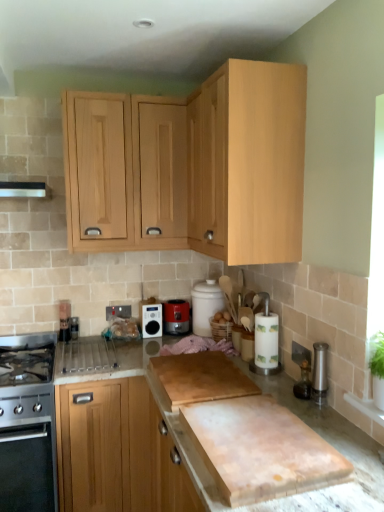
Describe the element at coordinates (249, 162) in the screenshot. I see `light wood cabinet at upper center, the 3th cabinetry from the top` at that location.

Where is `metallic silver toaster at lower left`? The image size is (384, 512). metallic silver toaster at lower left is located at coordinates (65, 320).

Measure the distance between point (196, 168) and camera.

A distance of 6.68 feet exists between point (196, 168) and camera.

This screenshot has width=384, height=512. I want to click on light wood cabinet at upper center, which is counted as the first cabinetry, starting from the top, so click(x=127, y=172).

What do you see at coordinates (176, 316) in the screenshot? I see `matte red toaster at center, which ranks as the third kitchen appliance in left-to-right order` at bounding box center [176, 316].

What are the coordinates of `matte red toaster at center, which ranks as the third kitchen appliance in left-to-right order` in the screenshot? It's located at (176, 316).

Where is `light wood cabinet at upper center, the 3th cabinetry from the top`? light wood cabinet at upper center, the 3th cabinetry from the top is located at coordinates (249, 162).

Is point (155, 313) positioned after point (100, 245)?

Yes, it is behind point (100, 245).

From a real-world perspective, is matte black radio at center, the 2th kitchen appliance when ordered from bottom to top, physically located above or below light wood cabinet at upper center, which is counted as the first cabinetry, starting from the top?

From a real-world perspective, matte black radio at center, the 2th kitchen appliance when ordered from bottom to top, is physically below light wood cabinet at upper center, which is counted as the first cabinetry, starting from the top.

Considering the positions of objects matte black radio at center, which is counted as the 2th kitchen appliance, starting from the left, and light wood cabinet at upper center, the fourth cabinetry in the bottom-to-top sequence, in the image provided, who is behind, matte black radio at center, which is counted as the 2th kitchen appliance, starting from the left, or light wood cabinet at upper center, the fourth cabinetry in the bottom-to-top sequence,?

matte black radio at center, which is counted as the 2th kitchen appliance, starting from the left, is more distant.

Is matte black radio at center, the 2th kitchen appliance when ordered from bottom to top, directly adjacent to light wood cabinet at upper center, which is counted as the first cabinetry, starting from the top?

matte black radio at center, the 2th kitchen appliance when ordered from bottom to top, and light wood cabinet at upper center, which is counted as the first cabinetry, starting from the top, are not in contact.

In the scene shown: Which point is more forward, (148, 313) or (228, 67)?

The point (228, 67) is more forward.

In the scene shown: From a real-world perspective, who is located higher, matte black radio at center, which is counted as the 2th kitchen appliance, starting from the left, or light wood cabinet at upper center, the 3th cabinetry from the top?

light wood cabinet at upper center, the 3th cabinetry from the top, is physically above.

Does matte black radio at center, which is the second kitchen appliance in top-to-bottom order, have a lesser height compared to light wood cabinet at upper center, the 3th cabinetry from the top?

Correct, matte black radio at center, which is the second kitchen appliance in top-to-bottom order, is not as tall as light wood cabinet at upper center, the 3th cabinetry from the top.

Is matte black radio at center, which is counted as the 2th kitchen appliance, starting from the left, next to light wood cabinet at upper center, the 3th cabinetry from the top, and touching it?

No, matte black radio at center, which is counted as the 2th kitchen appliance, starting from the left, is not touching light wood cabinet at upper center, the 3th cabinetry from the top.

Considering the relative sizes of matte red toaster at center, which is the 1th kitchen appliance in top-to-bottom order, and light wood cabinet at upper center, the 3th cabinetry from the top, in the image provided, is matte red toaster at center, which is the 1th kitchen appliance in top-to-bottom order, shorter than light wood cabinet at upper center, the 3th cabinetry from the top,?

Yes, matte red toaster at center, which is the 1th kitchen appliance in top-to-bottom order, is shorter than light wood cabinet at upper center, the 3th cabinetry from the top.

At what (x,y) coordinates should I click in order to perform the action: click on the 1st kitchen appliance below when counting from the light wood cabinet at upper center, the 3th cabinetry from the top (from the image's perspective). Please return your answer as a coordinate pair (x, y). Looking at the image, I should click on (176, 316).

Does matte red toaster at center, marked as the 3th kitchen appliance in a bottom-to-top arrangement, touch light wood cabinet at upper center, the 3th cabinetry from the top?

No, matte red toaster at center, marked as the 3th kitchen appliance in a bottom-to-top arrangement, is not beside light wood cabinet at upper center, the 3th cabinetry from the top.

Is light wood cabinet at upper center, the 2th cabinetry positioned from the bottom, at the back of matte red toaster at center, marked as the 3th kitchen appliance in a bottom-to-top arrangement?

No, matte red toaster at center, marked as the 3th kitchen appliance in a bottom-to-top arrangement, is not facing away from light wood cabinet at upper center, the 2th cabinetry positioned from the bottom.

From the image's perspective, is stainless steel oven at left, which is counted as the 3th kitchen appliance, starting from the top, on top of light wood cabinet at lower left, the 4th cabinetry viewed from the top?

No, from the image's perspective, stainless steel oven at left, which is counted as the 3th kitchen appliance, starting from the top, is not over light wood cabinet at lower left, the 4th cabinetry viewed from the top.

Does stainless steel oven at left, marked as the third kitchen appliance in a right-to-left arrangement, have a greater height compared to light wood cabinet at lower left, positioned as the 1th cabinetry in bottom-to-top order?

In fact, stainless steel oven at left, marked as the third kitchen appliance in a right-to-left arrangement, may be shorter than light wood cabinet at lower left, positioned as the 1th cabinetry in bottom-to-top order.

What's the angular difference between stainless steel oven at left, which is counted as the 3th kitchen appliance, starting from the top, and light wood cabinet at lower left, the 4th cabinetry viewed from the top,'s facing directions?

The facing directions of stainless steel oven at left, which is counted as the 3th kitchen appliance, starting from the top, and light wood cabinet at lower left, the 4th cabinetry viewed from the top, are 1.11 degrees apart.

Consider the image. Is light wood cabinet at lower left, positioned as the 1th cabinetry in bottom-to-top order, at the back of stainless steel oven at left, which is counted as the 3th kitchen appliance, starting from the top?

stainless steel oven at left, which is counted as the 3th kitchen appliance, starting from the top, is not turned away from light wood cabinet at lower left, positioned as the 1th cabinetry in bottom-to-top order.

Looking at this image, does natural wood cabinet at upper center, which is the 2th cabinetry from top to bottom, turn towards matte black radio at center, which is counted as the 2th kitchen appliance, starting from the left?

No, natural wood cabinet at upper center, which is the 2th cabinetry from top to bottom, does not turn towards matte black radio at center, which is counted as the 2th kitchen appliance, starting from the left.

Which cabinetry is the 1st one when counting from the right side of the matte black radio at center, the 2th kitchen appliance when ordered from bottom to top? Please provide its 2D coordinates.

[(191, 167)]

Considering the relative sizes of natural wood cabinet at upper center, which is the 2th cabinetry from top to bottom, and matte black radio at center, which is the second kitchen appliance in top-to-bottom order, in the image provided, is natural wood cabinet at upper center, which is the 2th cabinetry from top to bottom, thinner than matte black radio at center, which is the second kitchen appliance in top-to-bottom order,?

Incorrect, the width of natural wood cabinet at upper center, which is the 2th cabinetry from top to bottom, is not less than that of matte black radio at center, which is the second kitchen appliance in top-to-bottom order.

From the image's perspective, is natural wood cabinet at upper center, the 3th cabinetry ordered from the bottom, on matte black radio at center, which is counted as the 2th kitchen appliance, starting from the left?

Yes, from the image's perspective, natural wood cabinet at upper center, the 3th cabinetry ordered from the bottom, is on top of matte black radio at center, which is counted as the 2th kitchen appliance, starting from the left.

Consider the image. Between metallic silver toaster at lower left and light wood cabinet at lower left, positioned as the 1th cabinetry in bottom-to-top order, which one is positioned behind?

metallic silver toaster at lower left is further away from the camera.

Is metallic silver toaster at lower left outside of light wood cabinet at lower left, positioned as the 1th cabinetry in bottom-to-top order?

Absolutely, metallic silver toaster at lower left is external to light wood cabinet at lower left, positioned as the 1th cabinetry in bottom-to-top order.

Is metallic silver toaster at lower left looking in the opposite direction of light wood cabinet at lower left, the 4th cabinetry viewed from the top?

That's not correct — metallic silver toaster at lower left is not looking away from light wood cabinet at lower left, the 4th cabinetry viewed from the top.

Is point (70, 320) farther from camera compared to point (74, 410)?

Yes, it is.

From the image's perspective, which object appears higher, light wood cabinet at upper center, the fourth cabinetry in the bottom-to-top sequence, or natural wood cabinet at upper center, which is the 2th cabinetry from top to bottom?

light wood cabinet at upper center, the fourth cabinetry in the bottom-to-top sequence, appears higher in the image.

How many degrees apart are the facing directions of light wood cabinet at upper center, the fourth cabinetry in the bottom-to-top sequence, and natural wood cabinet at upper center, which is the 2th cabinetry from top to bottom?

0.000802 degrees separate the facing orientations of light wood cabinet at upper center, the fourth cabinetry in the bottom-to-top sequence, and natural wood cabinet at upper center, which is the 2th cabinetry from top to bottom.

Considering the relative sizes of light wood cabinet at upper center, the fourth cabinetry in the bottom-to-top sequence, and natural wood cabinet at upper center, the 3th cabinetry ordered from the bottom, in the image provided, is light wood cabinet at upper center, the fourth cabinetry in the bottom-to-top sequence, wider than natural wood cabinet at upper center, the 3th cabinetry ordered from the bottom,?

No.

The image size is (384, 512). Identify the location of the 1st cabinetry to the left of the matte black radio at center, which is the second kitchen appliance in top-to-bottom order, counting from the anchor's position. (127, 172).

The height and width of the screenshot is (512, 384). What are the coordinates of `kitchen appliance that is the 2nd object located below the light wood cabinet at upper center, the 3th cabinetry from the top (from the image's perspective)` in the screenshot? It's located at (151, 319).

In the scene shown: Estimate the real-world distances between objects in this image. Which object is further from natural wood cabinet at upper center, which is the 2th cabinetry from top to bottom, light wood cabinet at upper center, which is counted as the first cabinetry, starting from the top, or matte black radio at center, which is the second kitchen appliance in top-to-bottom order?

The object further to natural wood cabinet at upper center, which is the 2th cabinetry from top to bottom, is matte black radio at center, which is the second kitchen appliance in top-to-bottom order.

Based on their spatial positions, is natural wood cabinet at upper center, the 3th cabinetry ordered from the bottom, or matte black radio at center, which is the second kitchen appliance in top-to-bottom order, further from stainless steel oven at left, acting as the 1th kitchen appliance starting from the left?

natural wood cabinet at upper center, the 3th cabinetry ordered from the bottom, is further to stainless steel oven at left, acting as the 1th kitchen appliance starting from the left.

Based on the photo, based on their spatial positions, is natural wood cabinet at upper center, the 3th cabinetry ordered from the bottom, or matte red toaster at center, marked as the 3th kitchen appliance in a bottom-to-top arrangement, further from light wood cabinet at upper center, which is counted as the first cabinetry, starting from the top?

→ matte red toaster at center, marked as the 3th kitchen appliance in a bottom-to-top arrangement, is positioned further to the anchor light wood cabinet at upper center, which is counted as the first cabinetry, starting from the top.

Estimate the real-world distances between objects in this image. Which object is further from light wood cabinet at upper center, the 3th cabinetry from the top, metallic silver toaster at lower left or light wood cabinet at upper center, which is counted as the first cabinetry, starting from the top?

metallic silver toaster at lower left is further to light wood cabinet at upper center, the 3th cabinetry from the top.

Looking at the image, which one is located further to matte black radio at center, which is counted as the 2th kitchen appliance, starting from the left, stainless steel oven at left, which is counted as the 3th kitchen appliance, starting from the top, or natural wood cabinet at upper center, which is the 2th cabinetry from top to bottom?

stainless steel oven at left, which is counted as the 3th kitchen appliance, starting from the top, is positioned further to the anchor matte black radio at center, which is counted as the 2th kitchen appliance, starting from the left.

Which object lies further to the anchor point matte black radio at center, the 2th kitchen appliance when ordered from bottom to top, stainless steel oven at left, acting as the 1th kitchen appliance starting from the left, or matte red toaster at center, which is the 1th kitchen appliance in top-to-bottom order?

Among the two, stainless steel oven at left, acting as the 1th kitchen appliance starting from the left, is located further to matte black radio at center, the 2th kitchen appliance when ordered from bottom to top.

From the image, which object appears to be farther from matte red toaster at center, which ranks as the third kitchen appliance in left-to-right order, stainless steel oven at left, which is the 1th kitchen appliance in bottom-to-top order, or metallic silver toaster at lower left?

stainless steel oven at left, which is the 1th kitchen appliance in bottom-to-top order, lies further to matte red toaster at center, which ranks as the third kitchen appliance in left-to-right order, than the other object.

Looking at the image, which one is located closer to metallic silver toaster at lower left, stainless steel oven at left, acting as the 1th kitchen appliance starting from the left, or light wood cabinet at lower left, positioned as the 1th cabinetry in bottom-to-top order?

Based on the image, stainless steel oven at left, acting as the 1th kitchen appliance starting from the left, appears to be nearer to metallic silver toaster at lower left.

The width and height of the screenshot is (384, 512). I want to click on appliance between natural wood cabinet at upper center, the 3th cabinetry ordered from the bottom, and light wood cabinet at lower left, the 4th cabinetry viewed from the top, in the vertical direction, so click(65, 320).

The width and height of the screenshot is (384, 512). What are the coordinates of `appliance located between natural wood cabinet at upper center, which is the 2th cabinetry from top to bottom, and matte red toaster at center, marked as the 3th kitchen appliance in a bottom-to-top arrangement, in the depth direction` in the screenshot? It's located at (65, 320).

Locate an element on the screen. The image size is (384, 512). kitchen appliance between stainless steel oven at left, marked as the third kitchen appliance in a right-to-left arrangement, and matte red toaster at center, marked as the 3th kitchen appliance in a bottom-to-top arrangement, along the z-axis is located at coordinates (151, 319).

The image size is (384, 512). I want to click on kitchen appliance between matte red toaster at center, marked as the 3th kitchen appliance in a bottom-to-top arrangement, and light wood cabinet at lower left, the 4th cabinetry viewed from the top, in the up-down direction, so click(x=151, y=319).